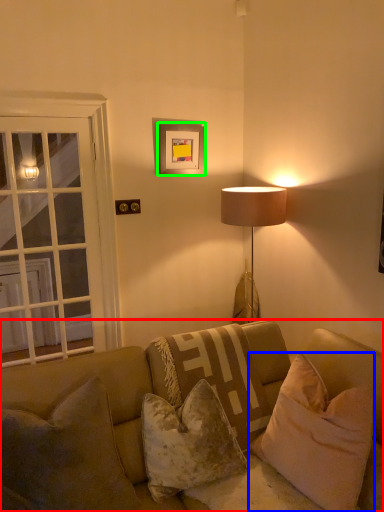
Question: Which object is the farthest from studio couch (highlighted by a red box)? Choose among these: pillow (highlighted by a blue box) or picture frame (highlighted by a green box).

Choices:
 (A) pillow
 (B) picture frame

Answer: (B)